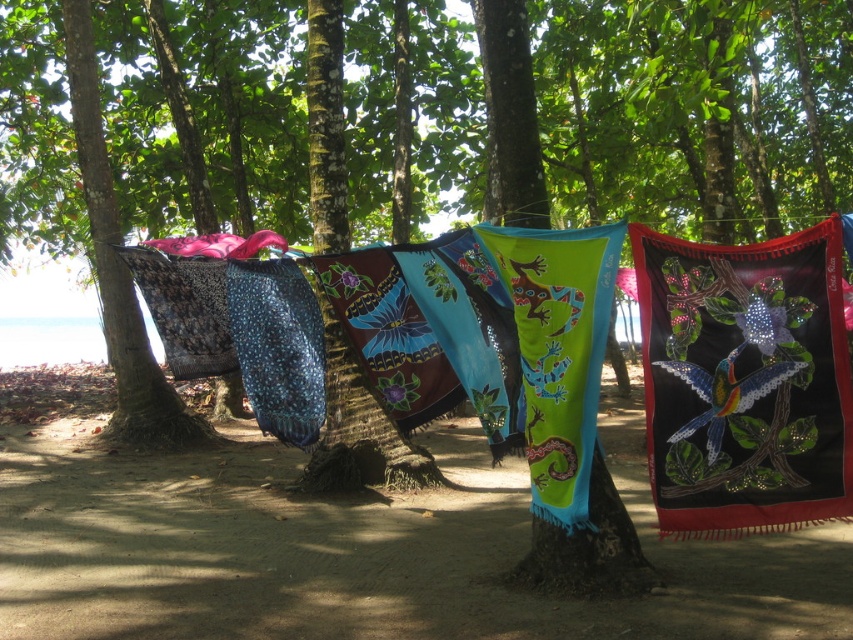
Identify the location of green fabric at center. The height and width of the screenshot is (640, 853). (558, 352).

Which of these two, textured fabric beach towels at center or blue knitted scarf at center, stands shorter?

Standing shorter between the two is textured fabric beach towels at center.

Does textured fabric beach towels at center appear on the left side of blue knitted scarf at center?

Indeed, textured fabric beach towels at center is positioned on the left side of blue knitted scarf at center.

Which is in front, point (312, 556) or point (299, 269)?

Point (312, 556) is in front.

At what (x,y) coordinates should I click in order to perform the action: click on textured fabric beach towels at center. Please return your answer as a coordinate pair (x, y). This screenshot has height=640, width=853. Looking at the image, I should click on pos(360,550).

Between black sequined cloth at center and green fabric at center, which one has more height?

black sequined cloth at center is taller.

Measure the distance from black sequined cloth at center to green fabric at center.

15.62 inches

Find the location of `black sequined cloth at center`. black sequined cloth at center is located at coordinates (744, 381).